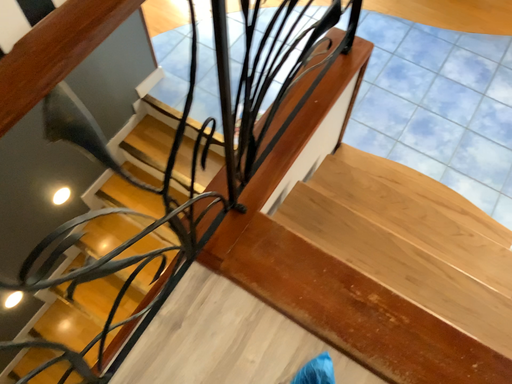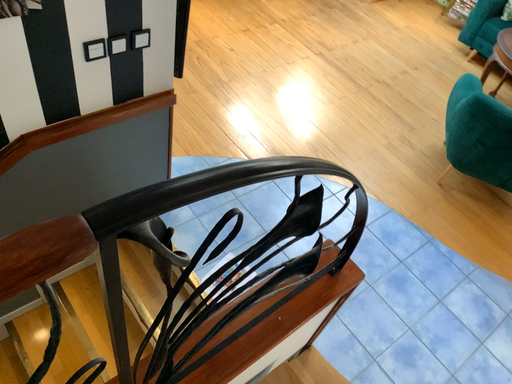
Question: How did the camera likely rotate when shooting the video?

Choices:
 (A) rotated upward
 (B) rotated downward

Answer: (A)